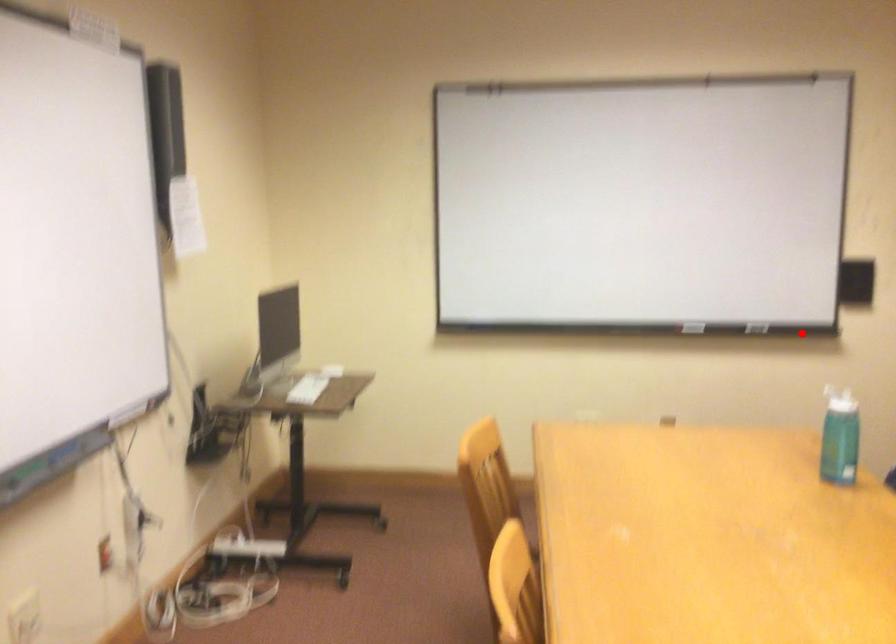
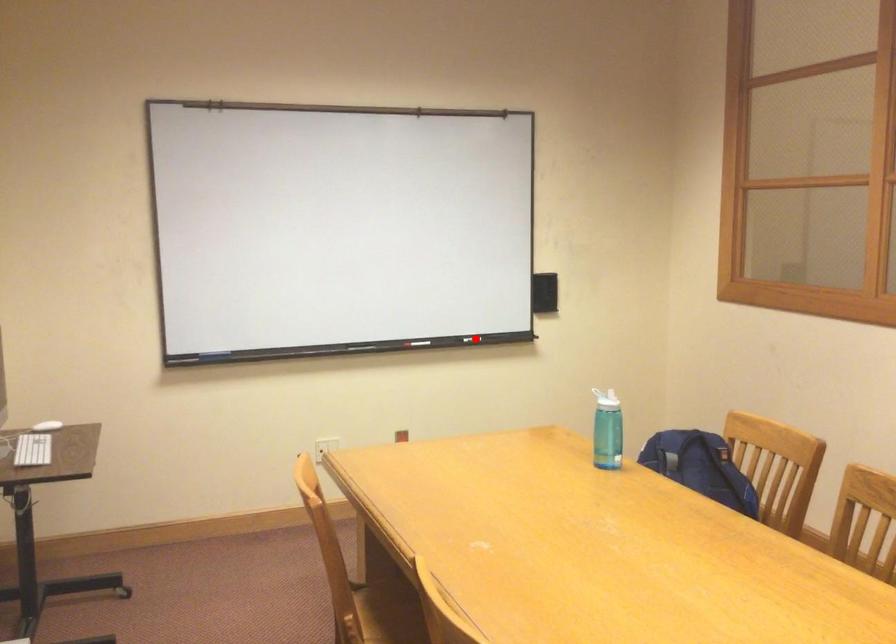
I am providing you with two images of the same scene from different viewpoints. A red point is marked on the first image and another point is marked on the second image. Does the point marked in image1 correspond to the same location as the one in image2?

Yes